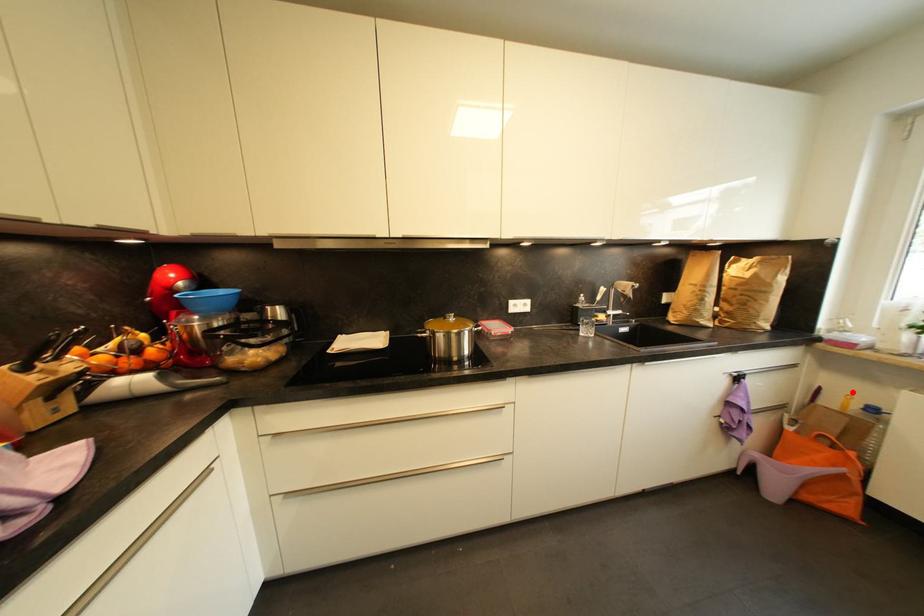
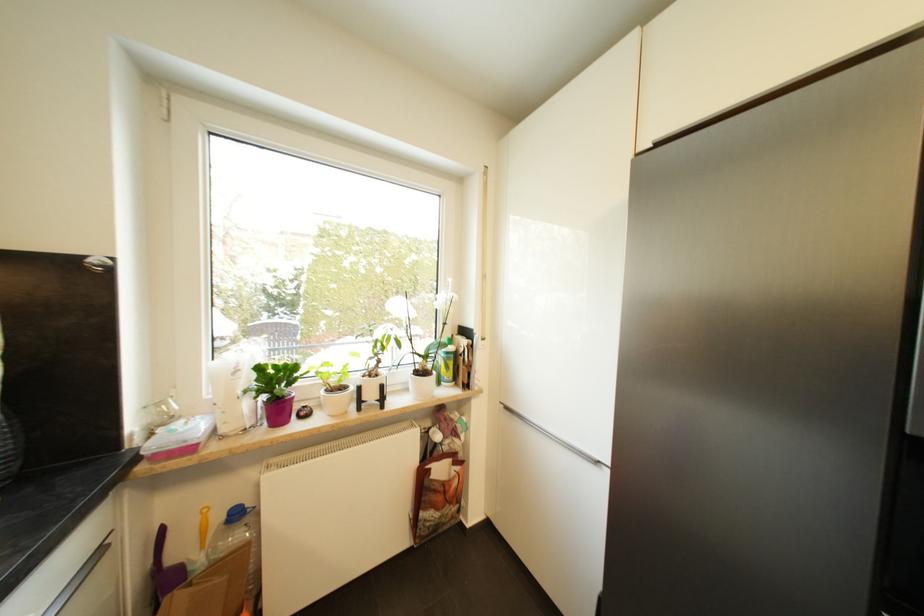
Find the pixel in the second image that matches the highlighted location in the first image.

(207, 507)